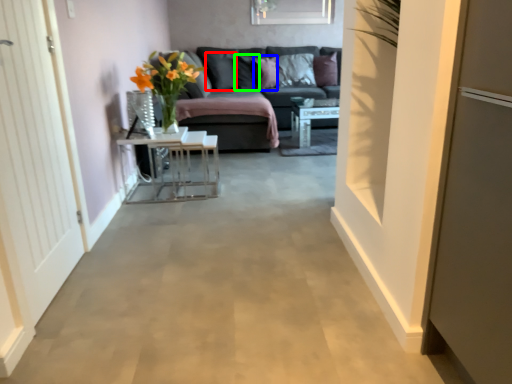
Question: Which object is positioned farthest from pillow (highlighted by a red box)? Select from pillow (highlighted by a blue box) and pillow (highlighted by a green box).

Choices:
 (A) pillow
 (B) pillow

Answer: (A)